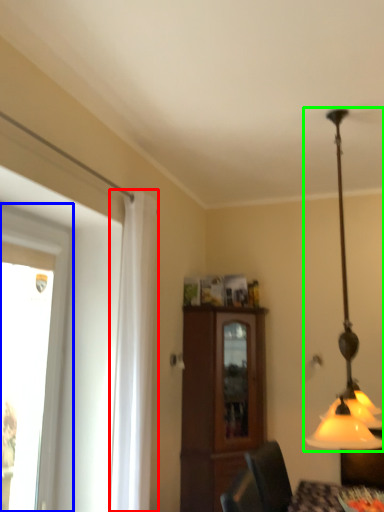
Question: Estimate the real-world distances between objects in this image. Which object is farther from curtain (highlighted by a red box), window (highlighted by a blue box) or lamp (highlighted by a green box)?

Choices:
 (A) window
 (B) lamp

Answer: (B)